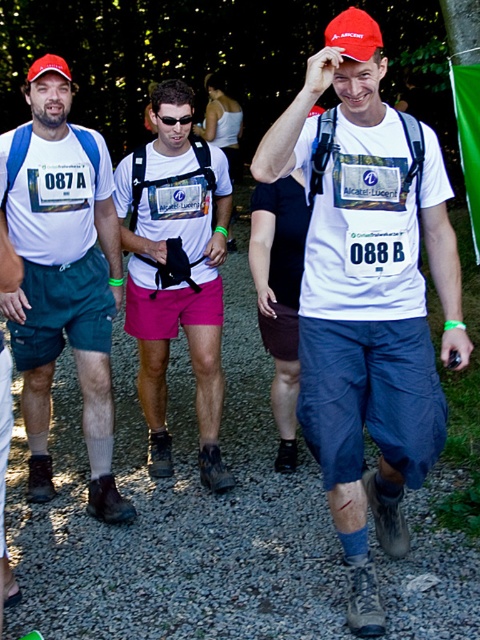
You are standing at the point labeled as point (387, 410) in the image. A friend is located 2.50 meters away from you. Can they see the numbered bibs of the participants in the race? Please explain your reasoning.

A: The point labeled point (387, 410) is 2.50 meters away from the viewer. Since the participants are part of the image and the distance is within a reasonable range for visibility, your friend can likely see the numbered bibs of the participants in the race.

You are a photographer positioned at the starting line of the race. You need to capture a photo that includes both the matte blue shorts at left and the pink fabric shorts at center. Based on their positions, which direction should you adjust your camera to include both in the frame?

The matte blue shorts at left is to the left of pink fabric shorts at center. To include both in the frame, adjust the camera to the left to capture the matte blue shorts at left and then pan towards the center to include the pink fabric shorts at center.